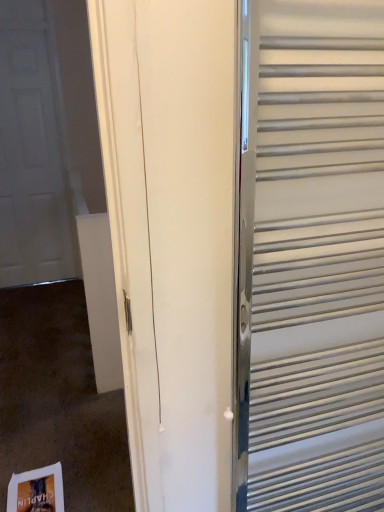
Question: From a real-world perspective, is white matte door at left positioned above or below metallic silver elevator at right?

Choices:
 (A) above
 (B) below

Answer: (A)

Question: In the image, is white matte door at left on the left side or the right side of metallic silver elevator at right?

Choices:
 (A) right
 (B) left

Answer: (B)

Question: From the image's perspective, is white matte door at left above or below metallic silver elevator at right?

Choices:
 (A) below
 (B) above

Answer: (B)

Question: Based on their sizes in the image, would you say metallic silver elevator at right is bigger or smaller than white matte door at left?

Choices:
 (A) small
 (B) big

Answer: (A)

Question: Is metallic silver elevator at right situated inside white matte door at left or outside?

Choices:
 (A) outside
 (B) inside

Answer: (A)

Question: Is point (311, 124) positioned closer to the camera than point (29, 54)?

Choices:
 (A) closer
 (B) farther

Answer: (A)

Question: From the image's perspective, is metallic silver elevator at right located above or below white matte door at left?

Choices:
 (A) above
 (B) below

Answer: (B)